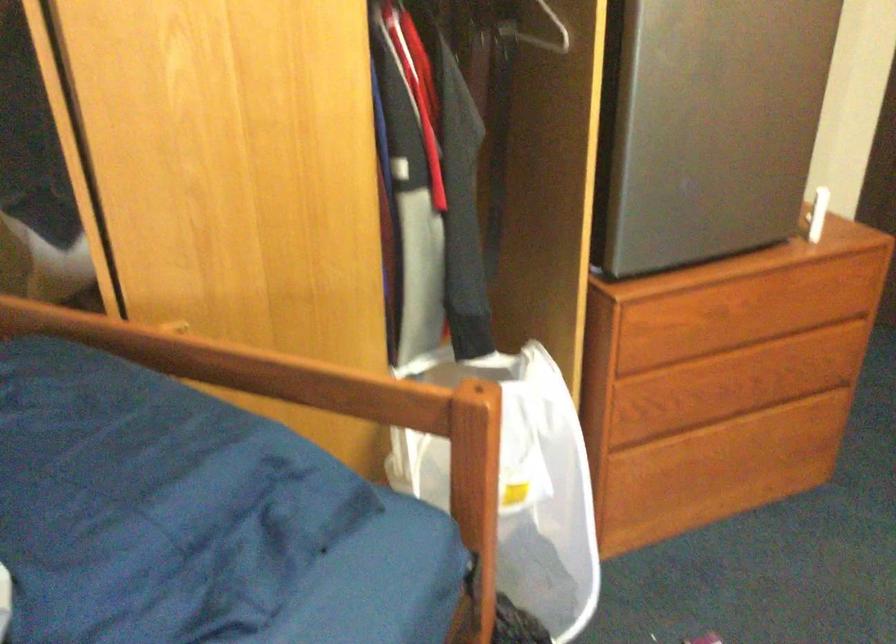
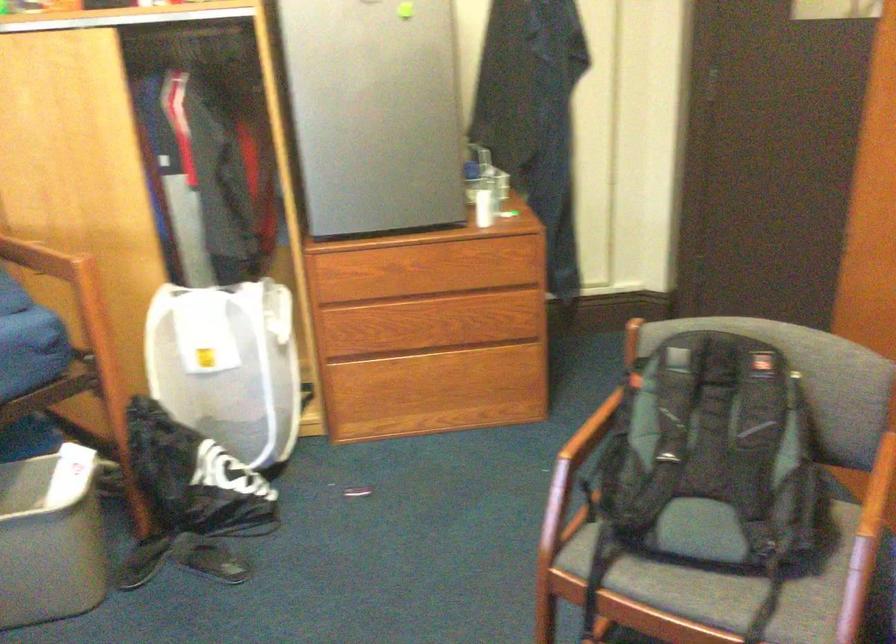
What movement of the cameraman would produce the second image?

The cameraman moved toward right, backward.